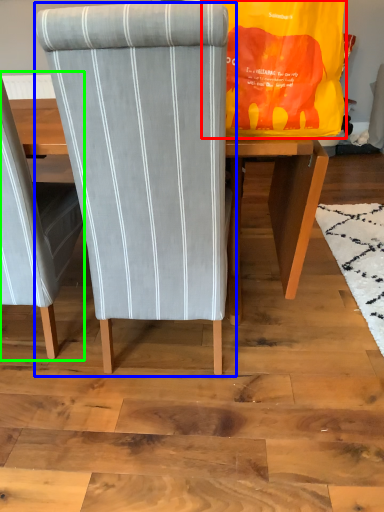
Question: Which object is positioned farthest from bag (highlighted by a red box)? Select from chair (highlighted by a blue box) and chair (highlighted by a green box).

Choices:
 (A) chair
 (B) chair

Answer: (B)